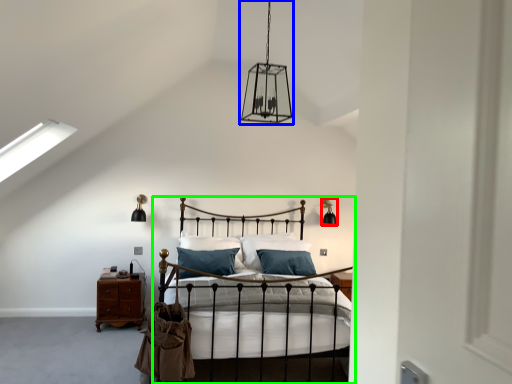
Question: Considering the real-world distances, which object is closest to light fixture (highlighted by a red box)? light fixture (highlighted by a blue box) or bed (highlighted by a green box).

Choices:
 (A) light fixture
 (B) bed

Answer: (B)